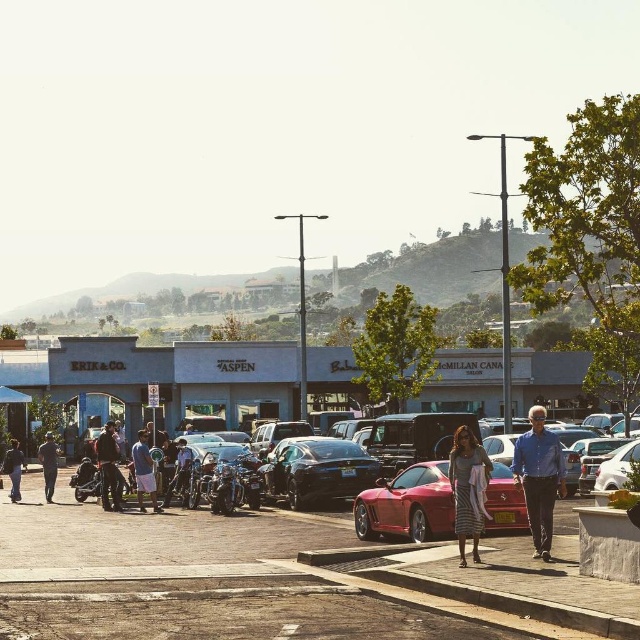
Question: Which point is closer to the camera?

Choices:
 (A) blue shirt at center
 (B) denim pants at center

Answer: (A)

Question: Which point appears closest to the camera in this image?

Choices:
 (A) (182, 448)
 (B) (118, 490)
 (C) (116, 468)

Answer: (B)

Question: Is the position of blue shirt at center more distant than that of shiny chrome motorcycle at center?

Choices:
 (A) no
 (B) yes

Answer: (A)

Question: Among these objects, which one is nearest to the camera?

Choices:
 (A) shiny chrome motorcycle at center
 (B) shiny chrome motorcycle at center-left

Answer: (A)

Question: Does denim shorts at center have a larger size compared to dark blue jeans at lower left?

Choices:
 (A) yes
 (B) no

Answer: (B)

Question: Can you confirm if shiny metallic car at center is wider than glossy black car at center?

Choices:
 (A) yes
 (B) no

Answer: (A)